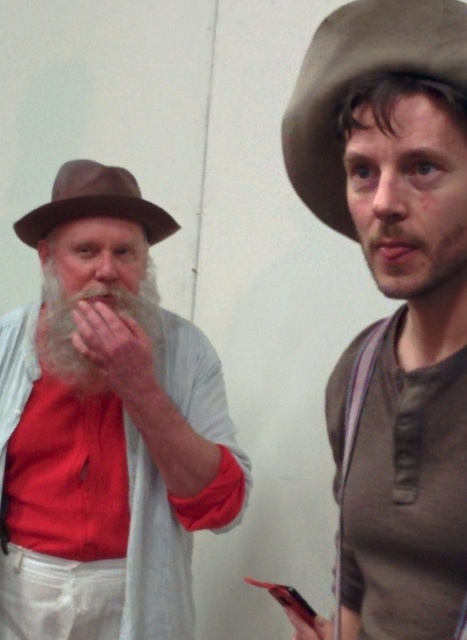
Can you confirm if brown felt hat at upper right is positioned below white soft beard at left?

Indeed, brown felt hat at upper right is positioned under white soft beard at left.

Which is above, brown felt hat at upper right or white soft beard at left?

white soft beard at left is higher up.

Image resolution: width=467 pixels, height=640 pixels. In order to click on brown felt hat at upper right in this screenshot , I will do `click(397, 294)`.

Which is below, brown felt hat at upper right or brown felt fedora at left?

brown felt hat at upper right

Is brown felt hat at upper right to the right of brown felt fedora at left from the viewer's perspective?

Yes, brown felt hat at upper right is to the right of brown felt fedora at left.

Identify the location of brown felt hat at upper right. The width and height of the screenshot is (467, 640). (397, 294).

The height and width of the screenshot is (640, 467). Find the location of `brown felt hat at upper right`. brown felt hat at upper right is located at coordinates (397, 294).

Between matte brown hat at left and brown felt hat at upper right, which one is positioned higher?

brown felt hat at upper right

What do you see at coordinates (106, 428) in the screenshot?
I see `matte brown hat at left` at bounding box center [106, 428].

The height and width of the screenshot is (640, 467). I want to click on matte brown hat at left, so click(106, 428).